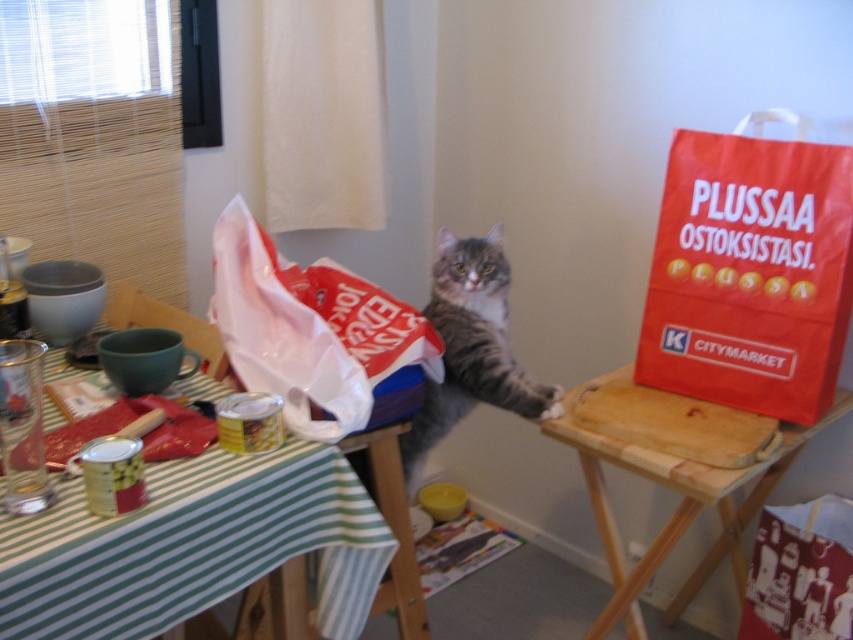
Which is behind, point (788, 465) or point (480, 348)?

The point (788, 465) is behind.

Who is more forward, [680,522] or [471,278]?

Point [680,522] is more forward.

Between point (641, 563) and point (408, 429), which one is positioned in front?

Point (641, 563) is in front.

Where is `wooden cutting board at upper right`? The height and width of the screenshot is (640, 853). wooden cutting board at upper right is located at coordinates (677, 504).

Which is more to the right, green striped fabric at lower left or tabby fur cat at center?

tabby fur cat at center is more to the right.

Does green striped fabric at lower left appear under tabby fur cat at center?

Yes.

Is point (45, 616) closer to camera compared to point (485, 340)?

Yes.

Where is `green striped fabric at lower left`? This screenshot has height=640, width=853. green striped fabric at lower left is located at coordinates (193, 547).

Between point (329, 598) and point (674, 486), which one is positioned behind?

Point (674, 486)

Does green striped fabric at lower left lie behind wooden cutting board at upper right?

No, green striped fabric at lower left is closer to the viewer.

Locate an element on the screen. This screenshot has width=853, height=640. green striped fabric at lower left is located at coordinates (193, 547).